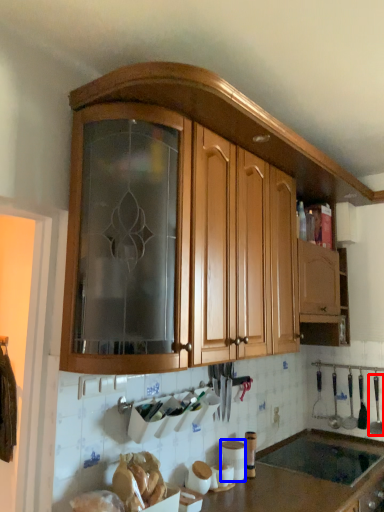
Question: Which of the following is the closest to the observer, silverware (highlighted by a red box) or appliance (highlighted by a blue box)?

Choices:
 (A) silverware
 (B) appliance

Answer: (B)